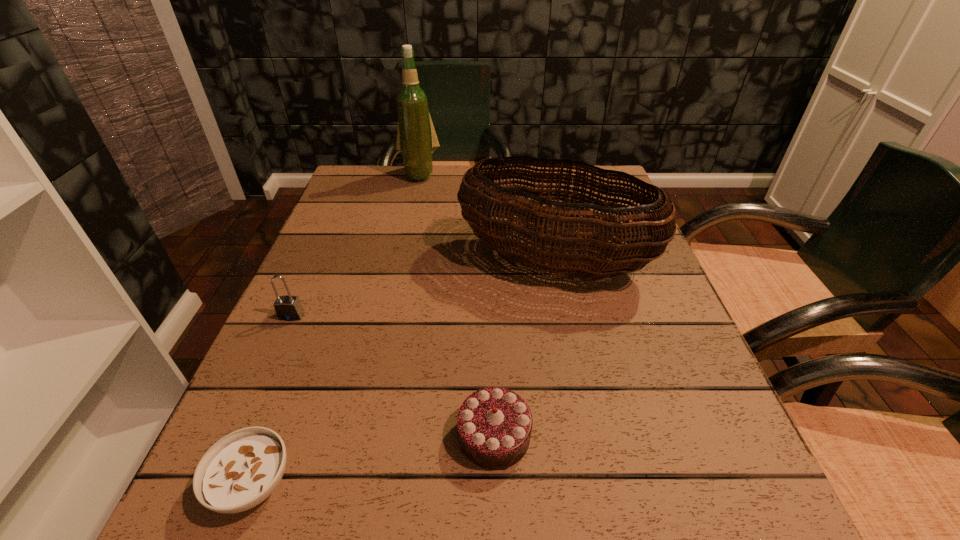
What are the coordinates of `free space between the farthest object and the third shortest object` in the screenshot? It's located at (355, 245).

Find the location of `free space between the third shortest object and the basket`. free space between the third shortest object and the basket is located at coordinates (422, 288).

Find the location of a particular element. This screenshot has width=960, height=540. vacant space that is in between the basket and the third shortest object is located at coordinates (422, 288).

The width and height of the screenshot is (960, 540). What are the coordinates of `vacant area between the padlock and the soup bowl` in the screenshot? It's located at (273, 400).

Where is `empty space that is in between the chocolate cake and the soup bowl`? This screenshot has height=540, width=960. empty space that is in between the chocolate cake and the soup bowl is located at coordinates (373, 460).

I want to click on free spot between the fourth nearest object and the chocolate cake, so click(524, 348).

This screenshot has height=540, width=960. In order to click on the closest object relative to the farthest object in this screenshot , I will do `click(563, 252)`.

Locate an element on the screen. the second closest object to the basket is located at coordinates (494, 424).

Find the location of a particular element. blank area in the image that satisfies the following two spatial constraints: 1. on the shackle of the chocolate cake; 2. on the right side of the third shortest object is located at coordinates (238, 435).

Identify the location of free space that satisfies the following two spatial constraints: 1. on the front-facing side of the tallest object; 2. on the right side of the second tallest object. (401, 261).